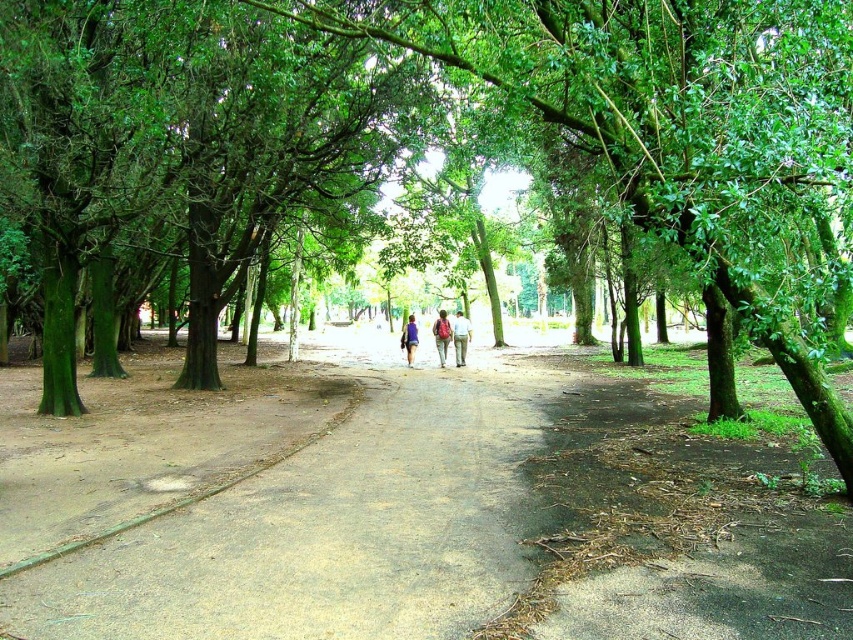
You are standing at the entrance of the park and see a point marked at coordinates (440, 336). According to the park map, this point corresponds to an object in the image. What object is this point located on?

The point at coordinates (440, 336) is located on the matte pink backpack at center.

You are standing at the entrance of the park and see the point marked at coordinates (460, 337). What object is located at that point?

The point at coordinates (460, 337) corresponds to light blue denim jeans at center.

You are a hiker who just finished a long walk and wants to place your backpack on the ground. You see two backpacks in the image, a matte pink backpack at center and a blue fabric backpack at center. If you want to place your backpack 2 feet away from the nearest backpack, which backpack should you choose to place yours next to?

The two backpacks are 4.35 feet apart. To place your backpack 2 feet away from the nearest, you can choose either backpack since there is enough space between them. Place it next to either the matte pink backpack at center or the blue fabric backpack at center.